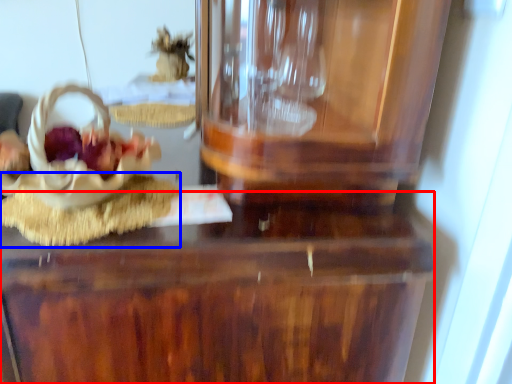
Question: Among these objects, which one is nearest to the camera, table (highlighted by a red box) or food (highlighted by a blue box)?

Choices:
 (A) table
 (B) food

Answer: (A)